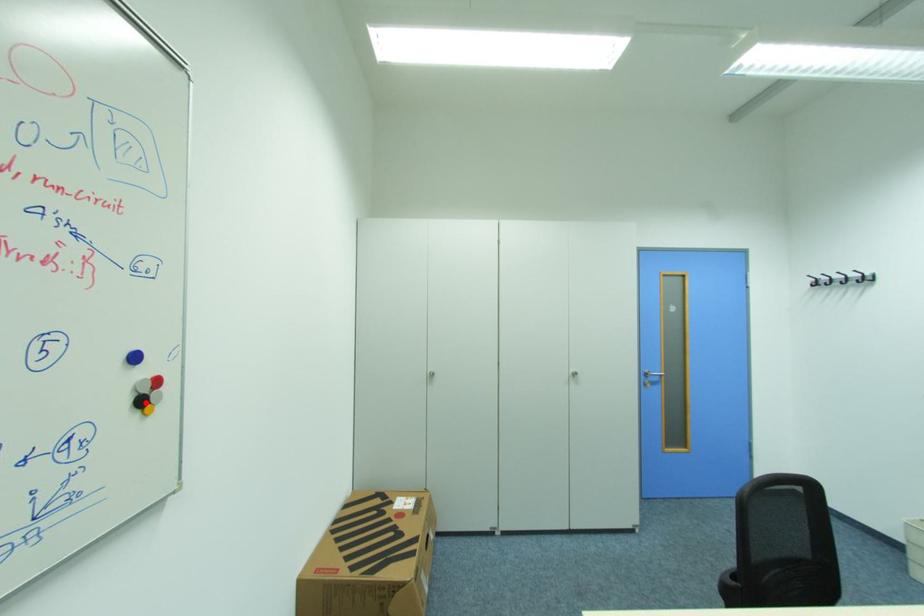
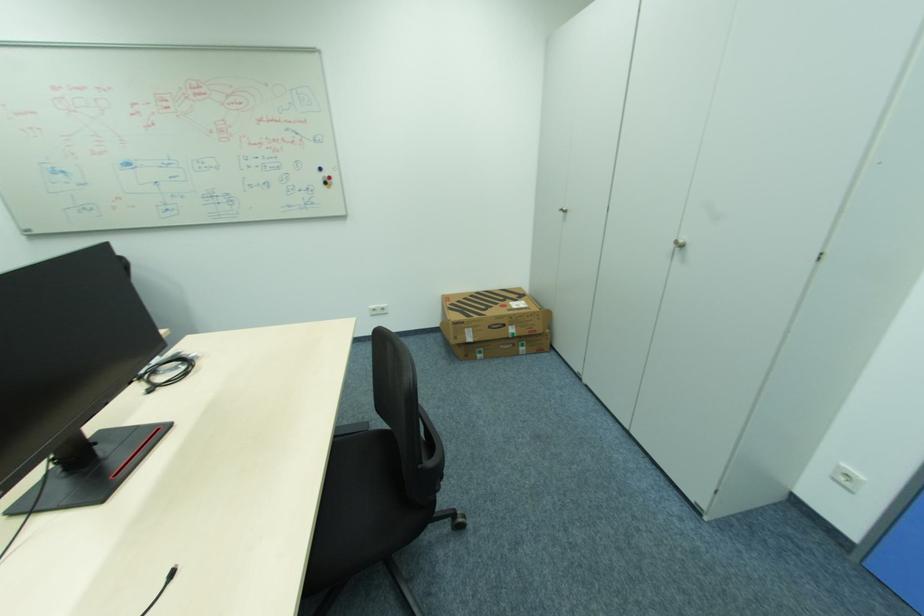
Locate, in the second image, the point that corresponds to the highlighted location in the first image.

(331, 184)